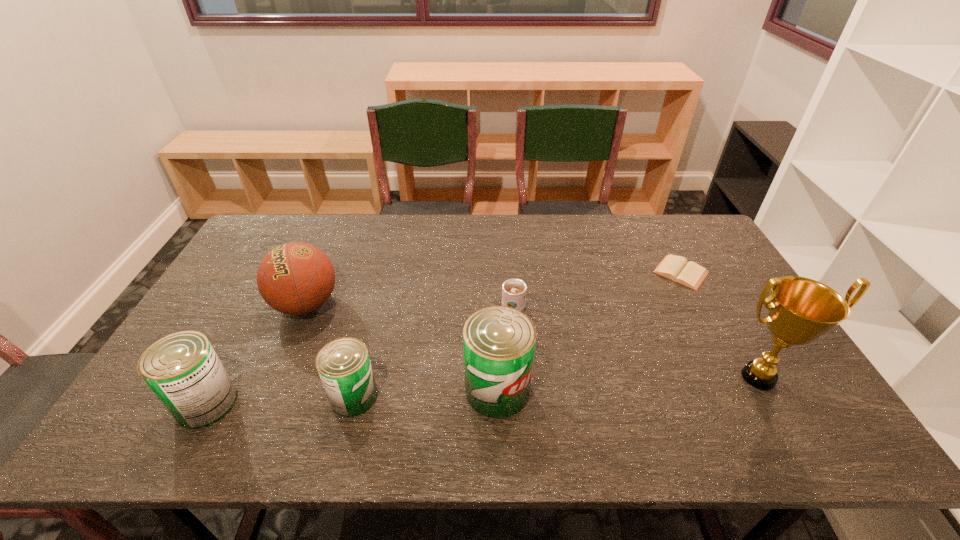
Identify the location of free space located 0.160m on the back of the rightmost can. (494, 319).

The image size is (960, 540). I want to click on blank space located 0.320m on the front of the shortest object, so click(x=736, y=377).

I want to click on free spot located 0.340m on the side with the handle of the cup, so click(507, 230).

The image size is (960, 540). I want to click on free space located on the side with the handle of the cup, so click(511, 283).

Where is `blank space located 0.070m on the side with the handle of the cup`? The image size is (960, 540). blank space located 0.070m on the side with the handle of the cup is located at coordinates (511, 279).

You are a GUI agent. You are given a task and a screenshot of the screen. Output one action in this format:
    pyautogui.click(x=<x>, y=<y>)
    Task: Click on the free space located on the right of the basketball
    Image resolution: width=960 pixels, height=540 pixels.
    Given the screenshot: What is the action you would take?
    pyautogui.click(x=412, y=305)

Locate an element on the screen. Image resolution: width=960 pixels, height=540 pixels. award that is at the near edge is located at coordinates (800, 310).

The image size is (960, 540). I want to click on object at the left edge, so (x=183, y=370).

Identify the location of diary present at the right edge. The width and height of the screenshot is (960, 540). (676, 268).

The width and height of the screenshot is (960, 540). I want to click on award situated at the right edge, so click(x=800, y=310).